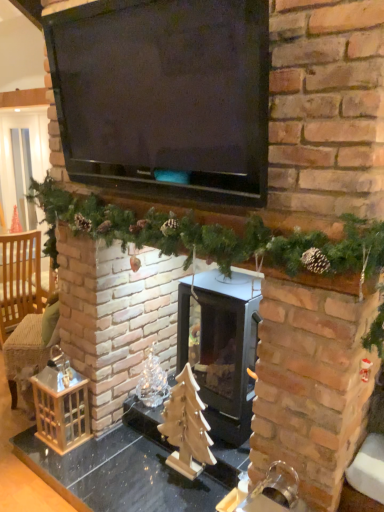
Locate an element on the screen. blank space to the left of wooden christmas tree at center is located at coordinates (133, 470).